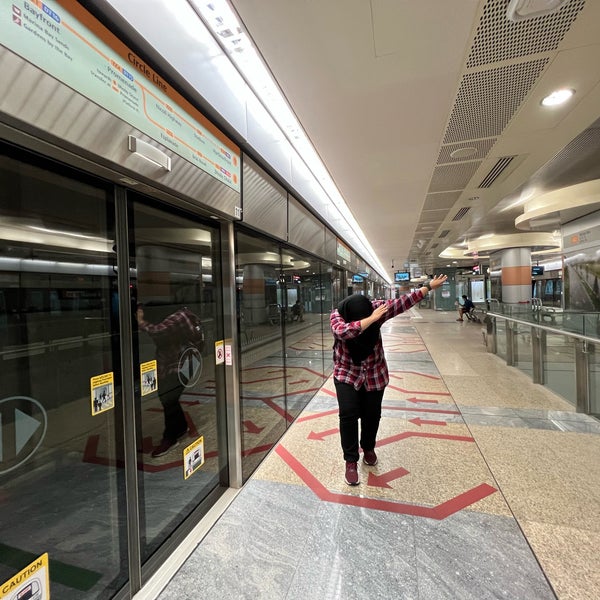
Identify the location of door. The width and height of the screenshot is (600, 600). (46, 148), (183, 203), (182, 537), (125, 592).